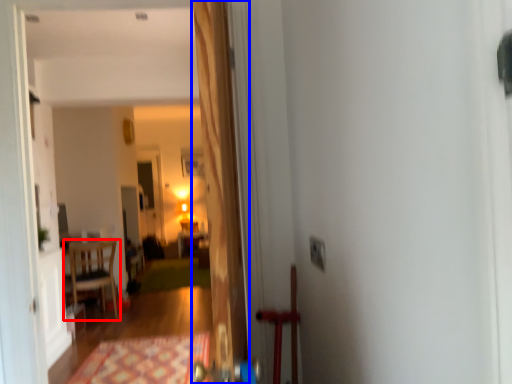
Question: Which of the following is the farthest to the observer, chair (highlighted by a red box) or door (highlighted by a blue box)?

Choices:
 (A) chair
 (B) door

Answer: (A)